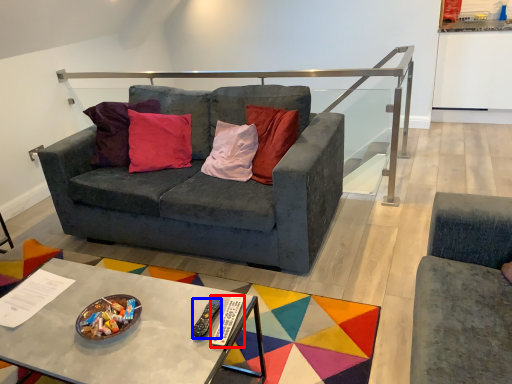
Question: Which object appears closest to the camera in this image, remote (highlighted by a red box) or remote (highlighted by a blue box)?

Choices:
 (A) remote
 (B) remote

Answer: (A)